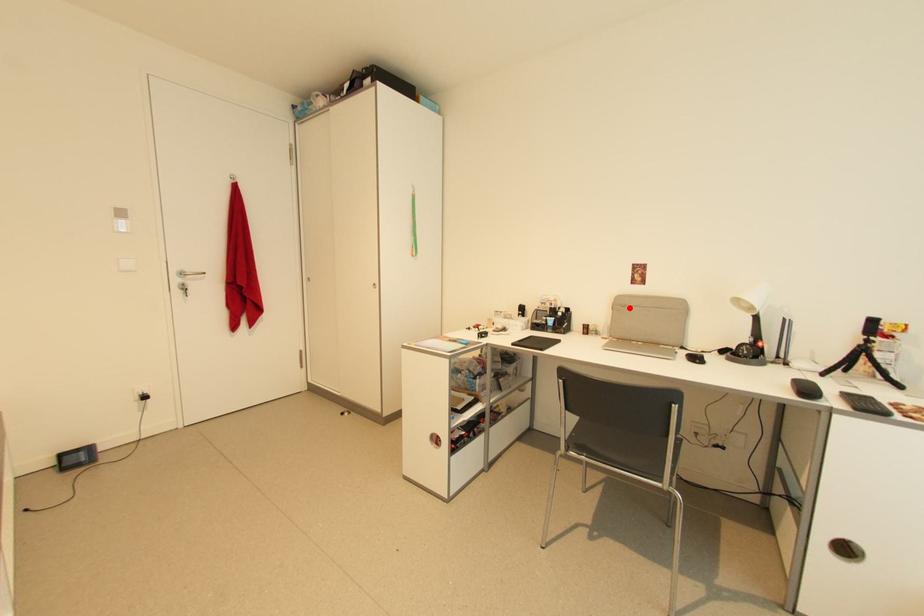
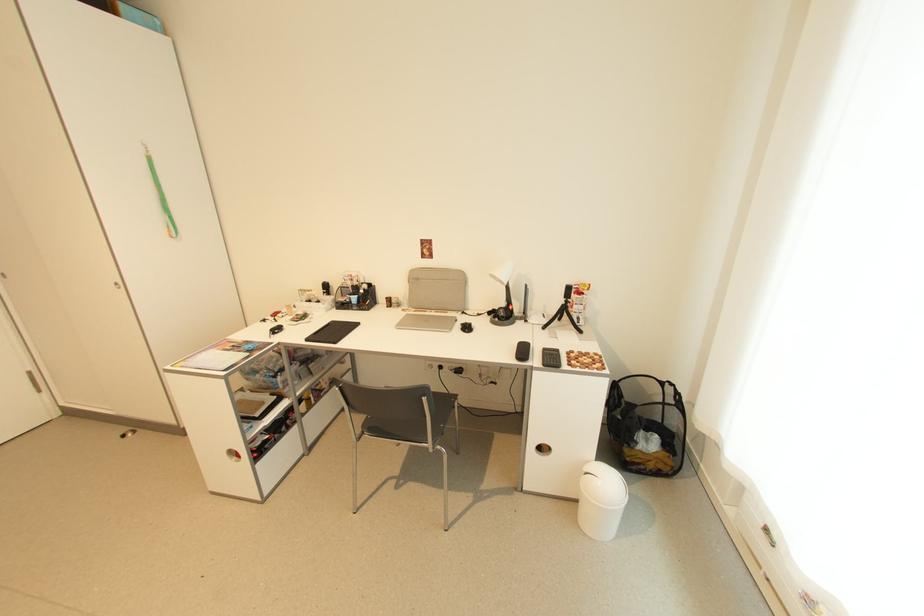
Locate, in the second image, the point that corresponds to the highlighted location in the first image.

(422, 281)